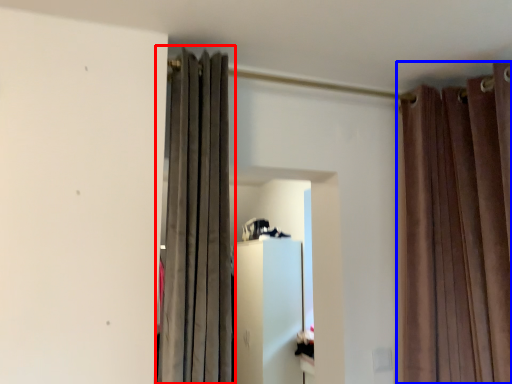
Question: Which object is further to the camera taking this photo, curtain (highlighted by a red box) or curtain (highlighted by a blue box)?

Choices:
 (A) curtain
 (B) curtain

Answer: (B)